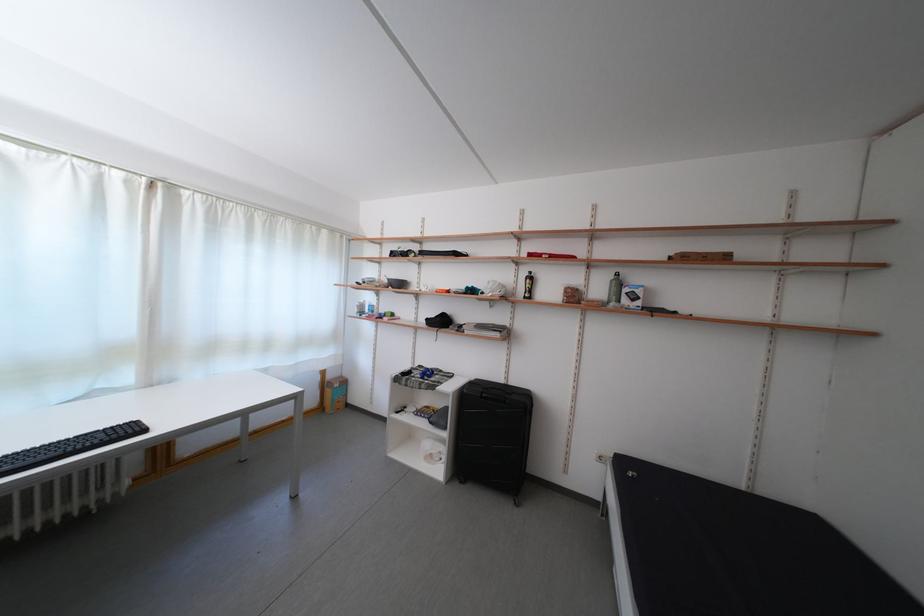
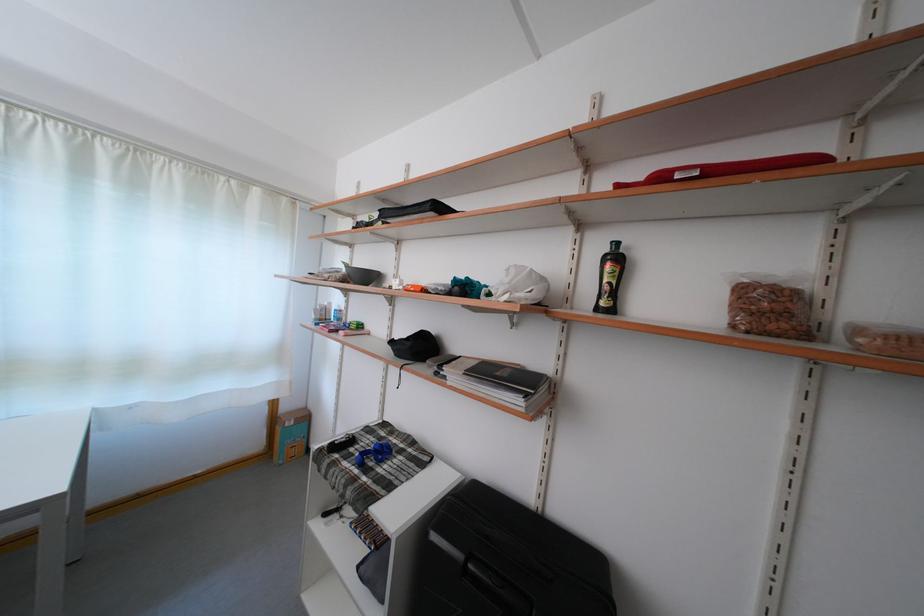
Find the pixel in the second image that matches (x=582, y=302) in the first image.

(782, 321)